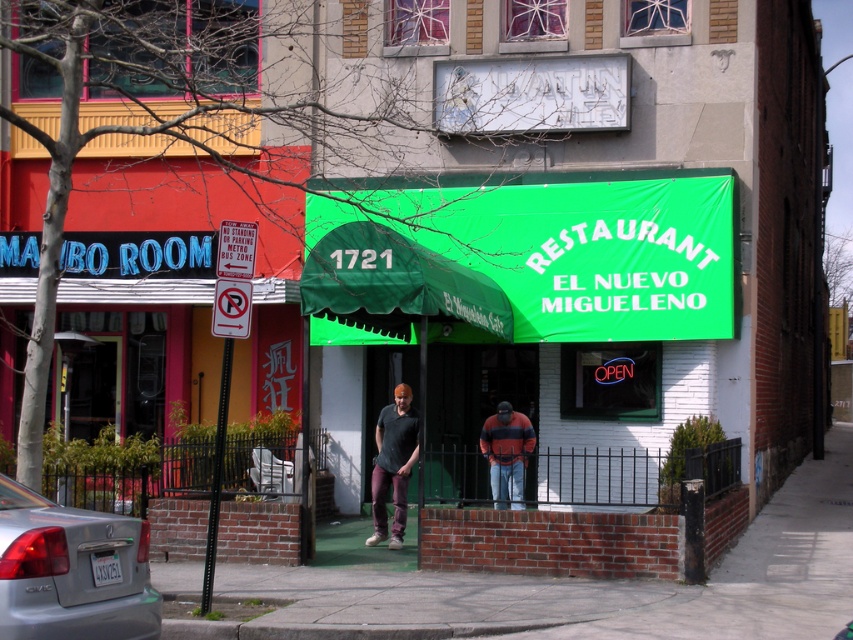
You are driving a car and want to park in front of the building with the green awning. There is a silver metallic sedan at lower left and a matte black shirt at center in the way. Can you park there without moving any objects?

The silver metallic sedan at lower left is positioned on the left side of matte black shirt at center. Since the sedan is blocking the parking spot in front of the green awning, you cannot park there without moving the sedan.

You are a delivery person who needs to place a matte black shirt at center in a secure location. Based on the scene, where would be the best place to leave it?

The best place to leave the matte black shirt at center would be inside the building with the green awning, as it has an entrance that can be secured and is less exposed to the street compared to the other building with the no parking signs.